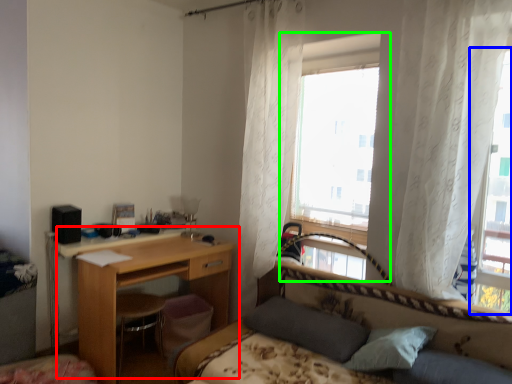
Question: Estimate the real-world distances between objects in this image. Which object is closer to desk (highlighted by a red box), window (highlighted by a blue box) or window (highlighted by a green box)?

Choices:
 (A) window
 (B) window

Answer: (B)